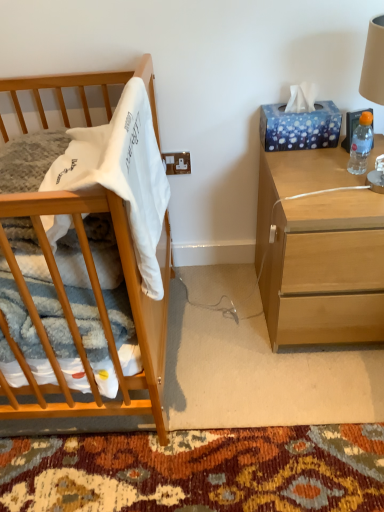
Question: Is light wood nightstand at right spatially inside blue glossy tissue box at upper right, or outside of it?

Choices:
 (A) outside
 (B) inside

Answer: (A)

Question: From a real-world perspective, is light wood nightstand at right above or below blue glossy tissue box at upper right?

Choices:
 (A) above
 (B) below

Answer: (B)

Question: Which is nearer to the light wood nightstand at right?

Choices:
 (A) light brown wood crib at left
 (B) white soft fabric at left
 (C) blue glossy tissue box at upper right
 (D) clear plastic bottle at right

Answer: (D)

Question: Considering the real-world distances, which object is farthest from the light brown wood crib at left?

Choices:
 (A) white soft fabric at left
 (B) light wood nightstand at right
 (C) blue glossy tissue box at upper right
 (D) clear plastic bottle at right

Answer: (D)